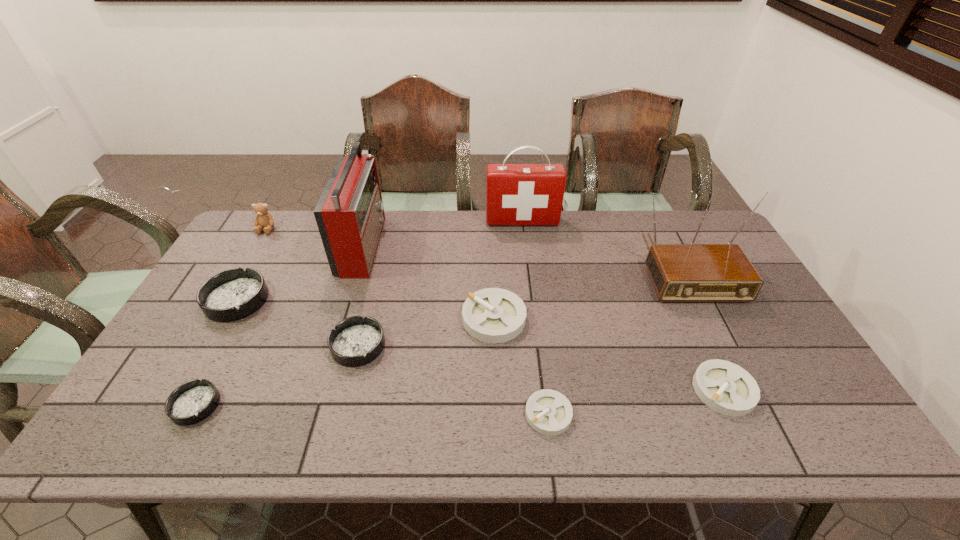
This screenshot has height=540, width=960. I want to click on dark ashtray that is the closest to the right radio_receiver, so click(356, 341).

The width and height of the screenshot is (960, 540). I want to click on the second closest gray ashtray to the fourth tallest object, so click(x=549, y=412).

Where is `the closest gray ashtray to the third ashtray from left to right`? the closest gray ashtray to the third ashtray from left to right is located at coordinates (493, 315).

Where is `vacant space that satisfies the following two spatial constraints: 1. on the front-facing side of the left radio_receiver; 2. on the right side of the farthest gray ashtray`? vacant space that satisfies the following two spatial constraints: 1. on the front-facing side of the left radio_receiver; 2. on the right side of the farthest gray ashtray is located at coordinates (340, 318).

Find the location of `blank area in the image that satisfies the following two spatial constraints: 1. on the front-facing side of the second biggest dark ashtray; 2. on the right side of the left radio_receiver`. blank area in the image that satisfies the following two spatial constraints: 1. on the front-facing side of the second biggest dark ashtray; 2. on the right side of the left radio_receiver is located at coordinates (332, 345).

Where is `vacant space that satisfies the following two spatial constraints: 1. on the face of the second nearest dark ashtray; 2. on the right side of the brown teddy bear`? vacant space that satisfies the following two spatial constraints: 1. on the face of the second nearest dark ashtray; 2. on the right side of the brown teddy bear is located at coordinates (199, 345).

Locate an element on the screen. The height and width of the screenshot is (540, 960). free region that satisfies the following two spatial constraints: 1. on the front side of the biggest gray ashtray; 2. on the left side of the rightmost gray ashtray is located at coordinates (496, 390).

Find the location of a particular element. vacant position in the image that satisfies the following two spatial constraints: 1. on the face of the brown teddy bear; 2. on the right side of the second smallest gray ashtray is located at coordinates (172, 390).

Where is `vacant space that satisfies the following two spatial constraints: 1. on the front face of the red first-aid kit; 2. on the front-facing side of the left radio_receiver`? vacant space that satisfies the following two spatial constraints: 1. on the front face of the red first-aid kit; 2. on the front-facing side of the left radio_receiver is located at coordinates (525, 245).

Find the location of a particular element. Image resolution: width=960 pixels, height=540 pixels. vacant position in the image that satisfies the following two spatial constraints: 1. on the front-facing side of the smallest gray ashtray; 2. on the left side of the left radio_receiver is located at coordinates (311, 414).